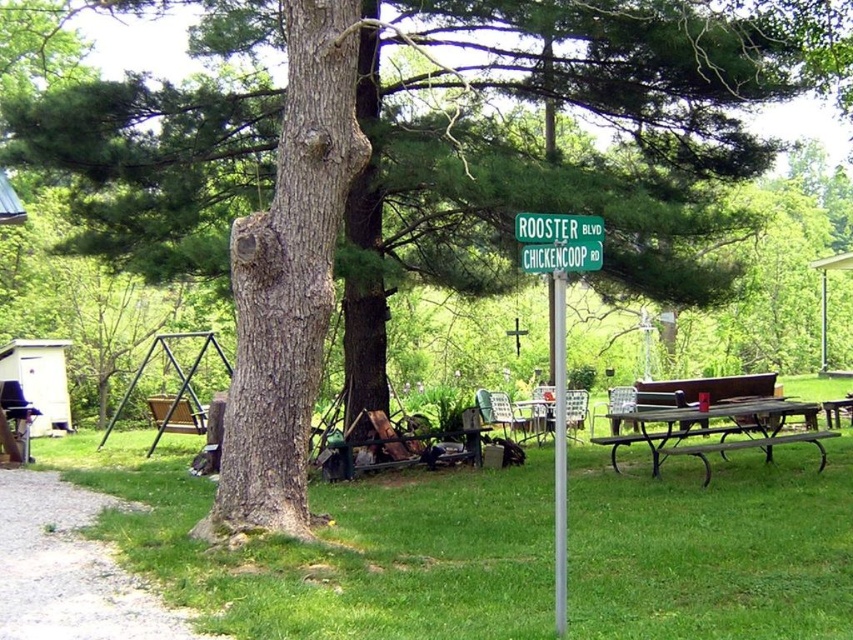
You are planning to set up a picnic and need to know the exact location of the metallic brown picnic table at center relative to the large tree and the street sign. Can you determine if the picnic table is closer to the tree or the street sign?

The metallic brown picnic table at center is located at point (714, 428). To determine its proximity to the tree and street sign, we need their coordinates. However, since only the picnic table has coordinates provided, we cannot directly compare distances without additional information about the tree and sign positions. Please provide coordinates for the tree and street sign to answer accurately.

Based on the photo, you are a pedestrian standing at the intersection of ROOSTER BLVD and CHICKENCOOP RD. You see the silver metallic pole at center and the brown wooden bench at lower right. Which object is higher from the ground?

The silver metallic pole at center is above the brown wooden bench at lower right, so the silver metallic pole at center is higher from the ground.